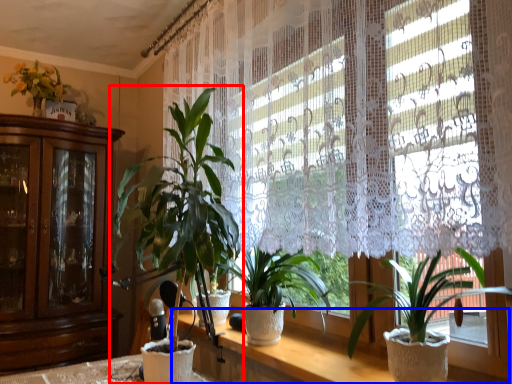
Question: Which object appears closest to the camera in this image, houseplant (highlighted by a red box) or vanity (highlighted by a blue box)?

Choices:
 (A) houseplant
 (B) vanity

Answer: (B)